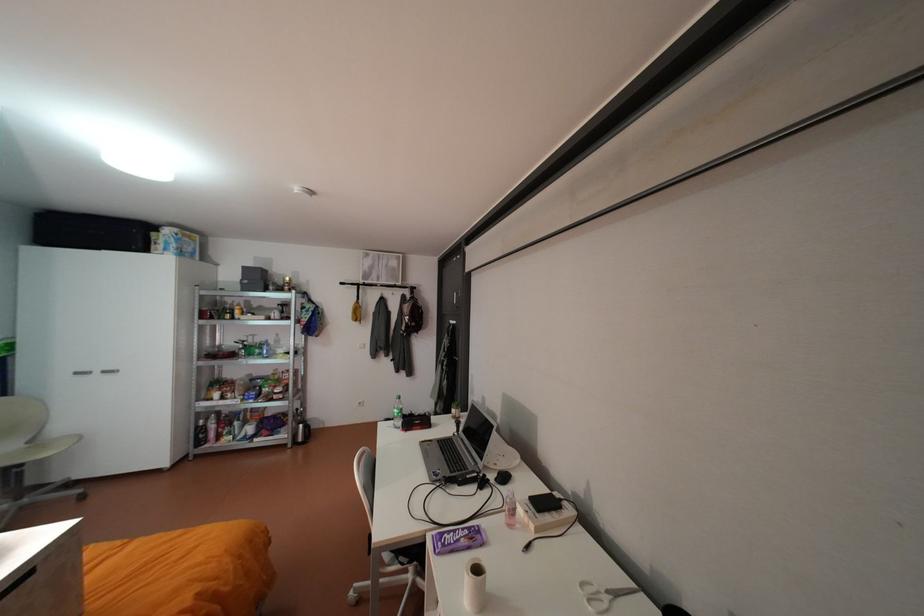
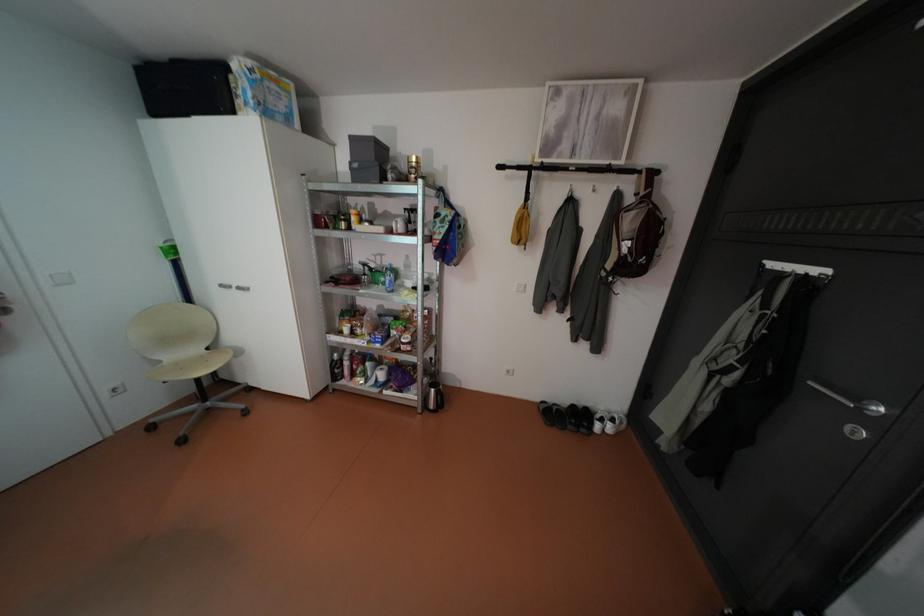
The point at (464, 322) is marked in the first image. Where is the corresponding point in the second image?

(827, 270)